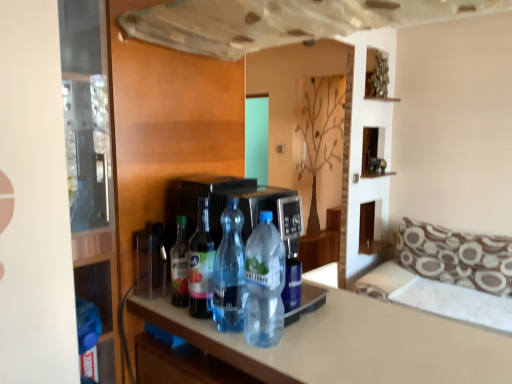
Where is `free space in front of transparent plastic bottle at center, which is the 2th bottle in right-to-left order`? This screenshot has width=512, height=384. free space in front of transparent plastic bottle at center, which is the 2th bottle in right-to-left order is located at coordinates (250, 354).